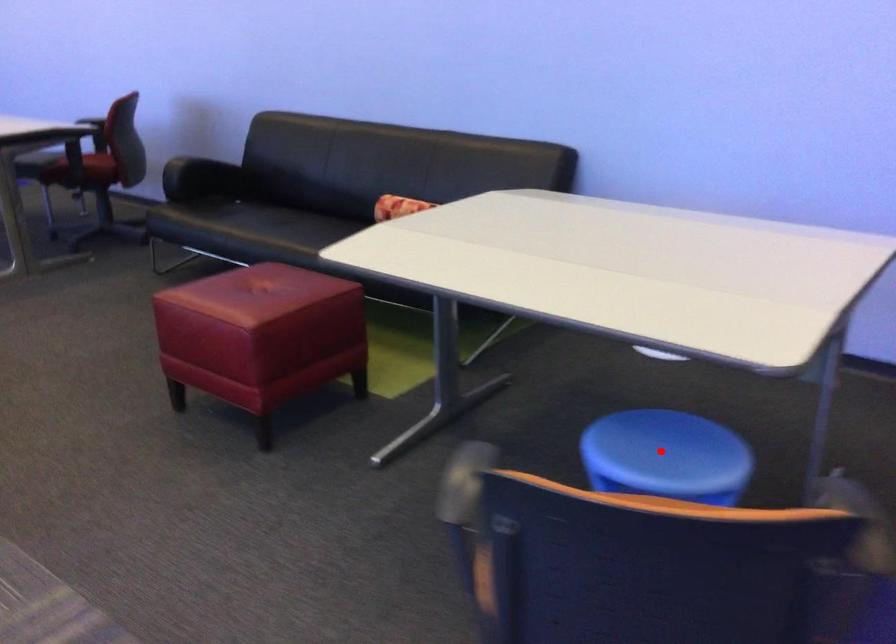
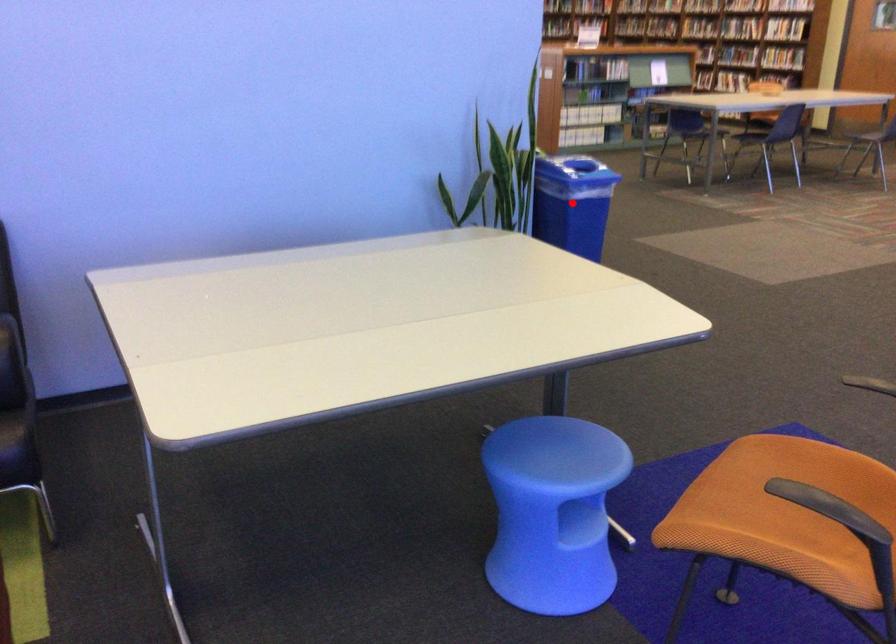
I am providing you with two images of the same scene from different viewpoints. A red point is marked on the first image and another point is marked on the second image. Are the points marked in image1 and image2 representing the same 3D position?

No